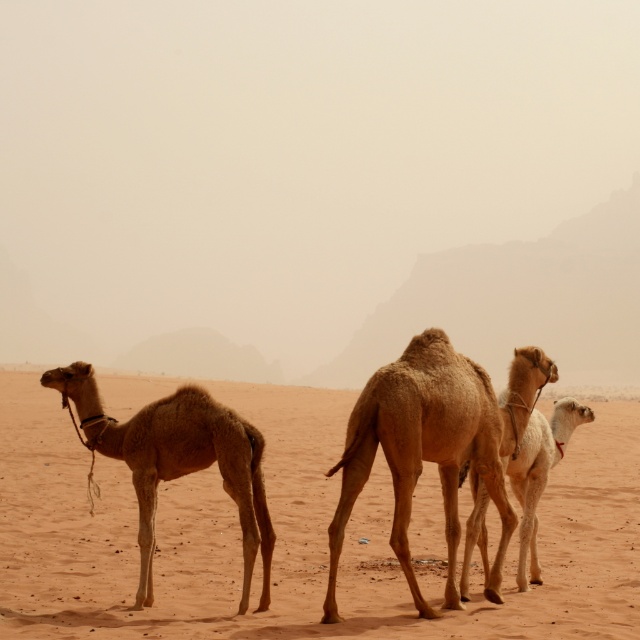
Consider the image. Is brown textured camel at center shorter than light brown textured camel at left?

No, brown textured camel at center is not shorter than light brown textured camel at left.

Identify the location of brown textured camel at center. (422, 452).

Locate an element on the screen. The image size is (640, 640). brown textured camel at center is located at coordinates (422, 452).

Is brown textured camel at center bigger than light brown smooth camel at center?

Yes.

Does point (451, 394) lie in front of point (570, 403)?

Yes, it is in front of point (570, 403).

Find the location of a particular element. brown textured camel at center is located at coordinates (422, 452).

Does point (291, 547) lie in front of point (554, 451)?

No, it is behind (554, 451).

Between sandy beige desert at center and light brown smooth camel at center, which one is positioned higher?

light brown smooth camel at center is above.

Between point (624, 508) and point (572, 429), which one is positioned behind?

Point (624, 508)

Find the location of a particular element. This screenshot has width=640, height=640. sandy beige desert at center is located at coordinates (291, 534).